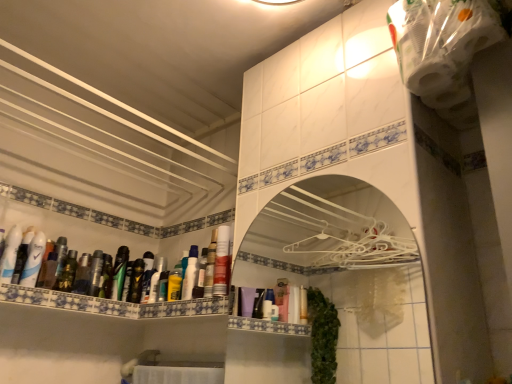
Question: Should I look upward or downward to see yellow matte bottle at center, the 3th mouthwash positioned from the right?

Choices:
 (A) up
 (B) down

Answer: (B)

Question: Can you confirm if green matte bottle at center, which ranks as the 3th toiletry in left-to-right order, is shorter than metallic silver mouthwash at left, acting as the seventh mouthwash starting from the left?

Choices:
 (A) yes
 (B) no

Answer: (A)

Question: Is green matte bottle at center, the 1th toiletry viewed from the back, behind metallic silver mouthwash at left, acting as the seventh mouthwash starting from the left?

Choices:
 (A) no
 (B) yes

Answer: (A)

Question: Is green matte bottle at center, which ranks as the 3th toiletry in left-to-right order, looking in the opposite direction of metallic silver mouthwash at left, which is the sixth mouthwash in right-to-left order?

Choices:
 (A) no
 (B) yes

Answer: (A)

Question: From a real-world perspective, is green matte bottle at center, the 1th toiletry viewed from the back, below metallic silver mouthwash at left, which is the sixth mouthwash in right-to-left order?

Choices:
 (A) no
 (B) yes

Answer: (B)

Question: Considering the relative sizes of green matte bottle at center, the 1th toiletry viewed from the back, and metallic silver mouthwash at left, acting as the seventh mouthwash starting from the left, in the image provided, is green matte bottle at center, the 1th toiletry viewed from the back, wider than metallic silver mouthwash at left, acting as the seventh mouthwash starting from the left,?

Choices:
 (A) yes
 (B) no

Answer: (B)

Question: Is green matte bottle at center, the 1th toiletry viewed from the back, not close to metallic silver mouthwash at left, acting as the seventh mouthwash starting from the left?

Choices:
 (A) yes
 (B) no

Answer: (B)

Question: Is white glossy bottle at upper left, the 4th mouthwash in the right-to-left sequence, shorter than matte plastic mouthwash at left, the 5th mouthwash when ordered from right to left?

Choices:
 (A) no
 (B) yes

Answer: (A)

Question: Is white glossy bottle at upper left, positioned as the ninth mouthwash in left-to-right order, next to matte plastic mouthwash at left, acting as the 8th mouthwash starting from the left?

Choices:
 (A) no
 (B) yes

Answer: (B)

Question: Is white glossy bottle at upper left, positioned as the ninth mouthwash in left-to-right order, oriented away from matte plastic mouthwash at left, acting as the 8th mouthwash starting from the left?

Choices:
 (A) no
 (B) yes

Answer: (B)

Question: From the image's perspective, would you say white glossy bottle at upper left, the 4th mouthwash in the right-to-left sequence, is positioned over matte plastic mouthwash at left, acting as the 8th mouthwash starting from the left?

Choices:
 (A) yes
 (B) no

Answer: (A)

Question: Can you confirm if white glossy bottle at upper left, the 4th mouthwash in the right-to-left sequence, is taller than matte plastic mouthwash at left, acting as the 8th mouthwash starting from the left?

Choices:
 (A) no
 (B) yes

Answer: (B)

Question: Is white glossy bottle at upper left, the 4th mouthwash in the right-to-left sequence, bigger than matte plastic mouthwash at left, acting as the 8th mouthwash starting from the left?

Choices:
 (A) yes
 (B) no

Answer: (A)

Question: Could you tell me if green matte mouthwash at left, which is the 3th mouthwash in left-to-right order, is facing white glossy medicine cabinet at center?

Choices:
 (A) yes
 (B) no

Answer: (A)